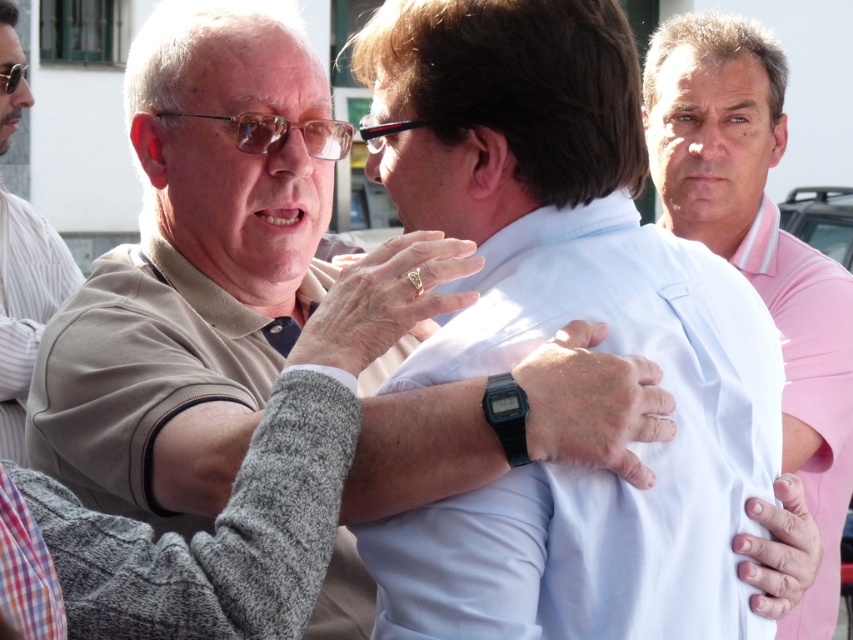
You are a fashion designer analyzing clothing sizes in the image. Given that the white smooth shirt at center is wider than the pink cotton polo shirt at center, which shirt would you recommend for a client who prefers a looser fit?

The white smooth shirt at center is wider than the pink cotton polo shirt at center, so it would be the better recommendation for a client seeking a looser fit.